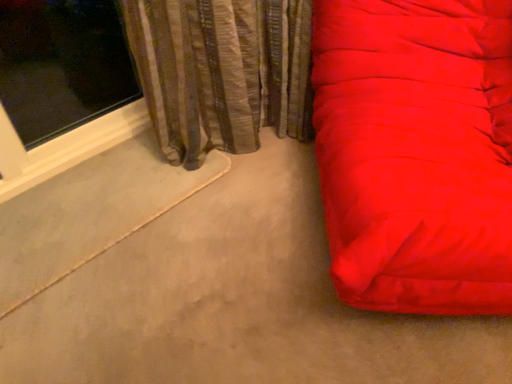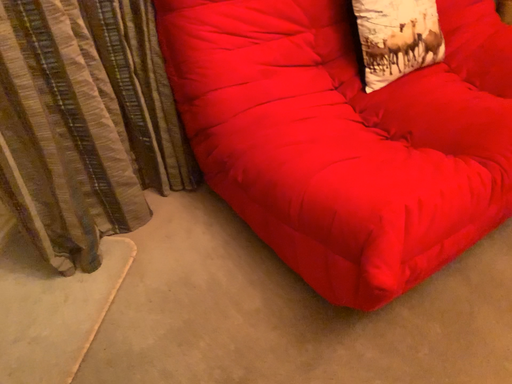
Question: How did the camera likely rotate when shooting the video?

Choices:
 (A) rotated right
 (B) rotated left

Answer: (A)